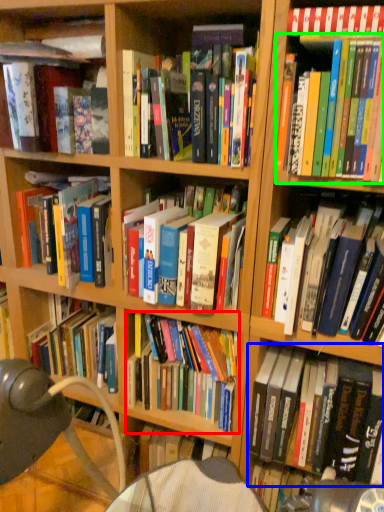
Question: Which object is the closest to the book (highlighted by a red box)? Choose among these: book (highlighted by a blue box) or book (highlighted by a green box).

Choices:
 (A) book
 (B) book

Answer: (A)